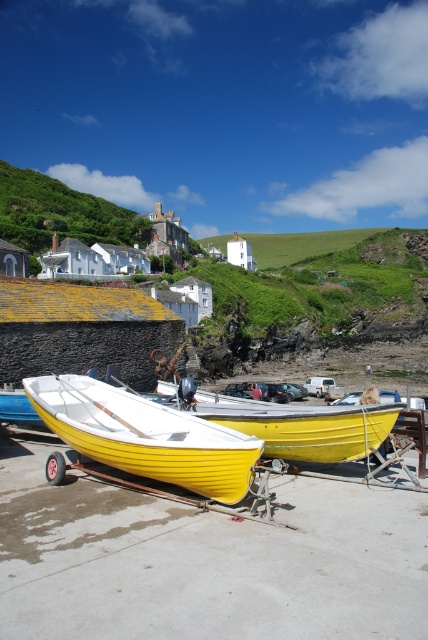
Question: Where is yellow matte boat at center located in relation to yellow matte canoe at center in the image?

Choices:
 (A) left
 (B) right

Answer: (A)

Question: Can you confirm if yellow matte boat at center is positioned to the right of yellow matte canoe at center?

Choices:
 (A) yes
 (B) no

Answer: (B)

Question: Which of the following is the closest to the observer?

Choices:
 (A) yellow matte boat at center
 (B) yellow matte canoe at center

Answer: (A)

Question: Is yellow matte boat at center in front of yellow matte canoe at center?

Choices:
 (A) yes
 (B) no

Answer: (A)